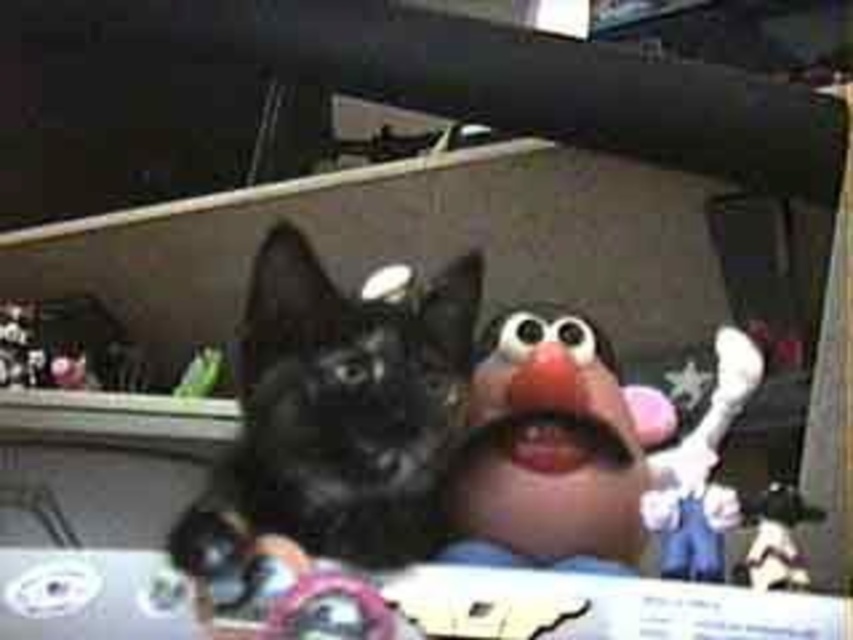
Is black fur cat at center to the right of matte plastic puppet at center from the viewer's perspective?

No, black fur cat at center is not to the right of matte plastic puppet at center.

Can you confirm if black fur cat at center is taller than matte plastic puppet at center?

Correct, black fur cat at center is much taller as matte plastic puppet at center.

Between point (422, 481) and point (583, 419), which one is positioned in front?

Point (422, 481) is more forward.

At what (x,y) coordinates should I click in order to perform the action: click on black fur cat at center. Please return your answer as a coordinate pair (x, y). This screenshot has width=853, height=640. Looking at the image, I should click on (338, 412).